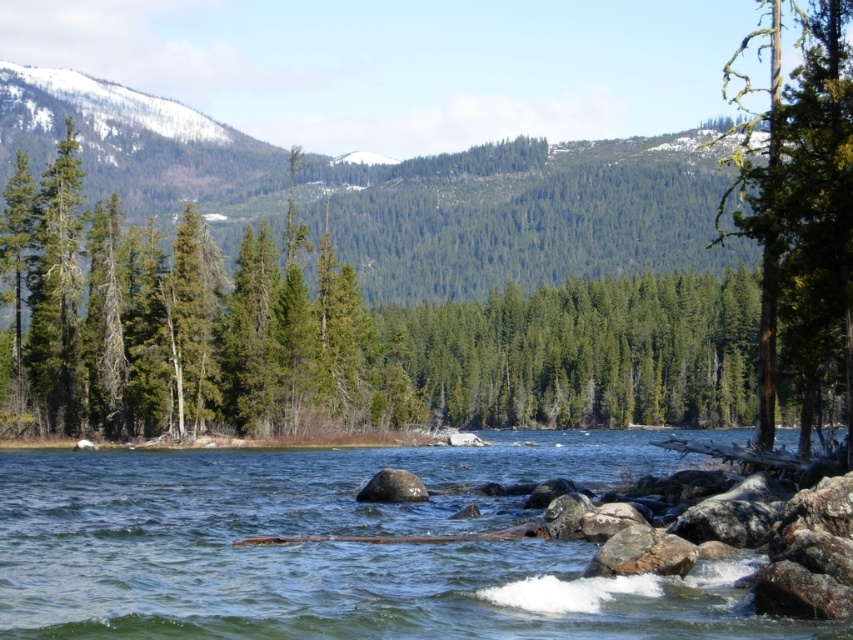
Question: Can you confirm if green matte tree at center is bigger than smooth gray rock at center?

Choices:
 (A) no
 (B) yes

Answer: (B)

Question: Does green matte tree at center have a smaller size compared to clear water at center?

Choices:
 (A) no
 (B) yes

Answer: (A)

Question: Which point appears farthest from the camera in this image?

Choices:
 (A) (166, 253)
 (B) (91, 525)
 (C) (796, 10)

Answer: (C)

Question: Can you confirm if green matte tree at center is positioned above clear water at center?

Choices:
 (A) yes
 (B) no

Answer: (A)

Question: Which of these objects is positioned closest to the green matte tree at center?

Choices:
 (A) green rough bark tree at right
 (B) smooth gray rock at center

Answer: (A)

Question: Which point is closer to the camera taking this photo?

Choices:
 (A) (438, 499)
 (B) (581, 300)
 (C) (374, 480)
 (D) (834, 259)

Answer: (D)